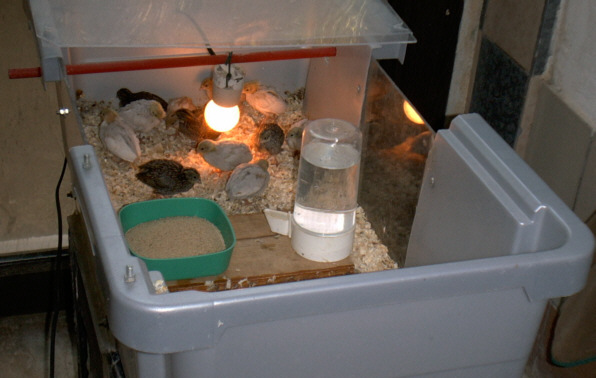
In order to click on grey tub in this screenshot , I will do `click(458, 323)`.